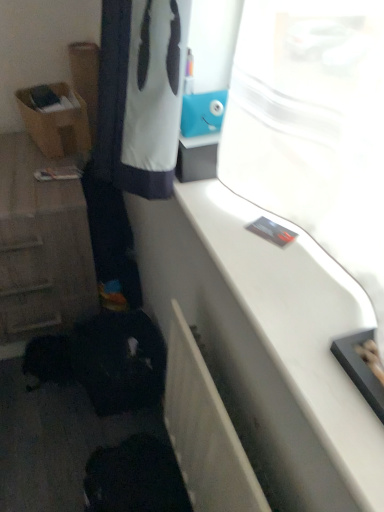
Image resolution: width=384 pixels, height=512 pixels. Find the location of `vacant area that lies in front of brown cardboard box at left`. vacant area that lies in front of brown cardboard box at left is located at coordinates (34, 163).